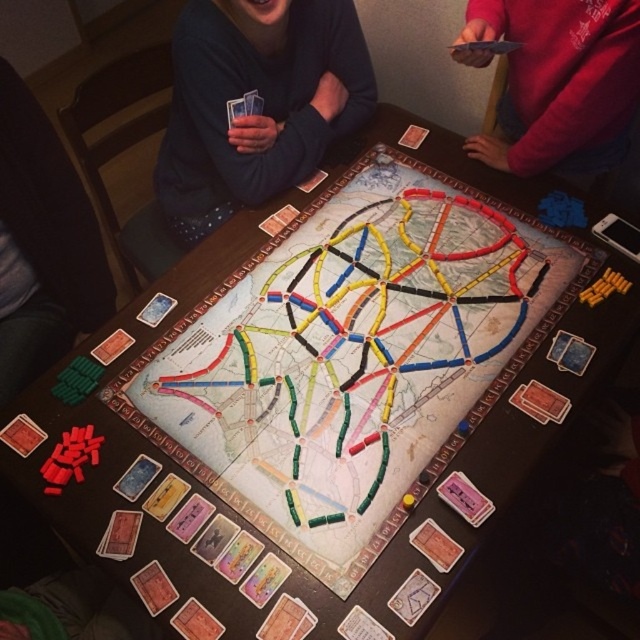
What do you see at coordinates (262, 102) in the screenshot?
I see `dark blue sweater at upper center` at bounding box center [262, 102].

Between point (250, 170) and point (552, 19), which one is positioned behind?

The point (250, 170) is behind.

You are a GUI agent. You are given a task and a screenshot of the screen. Output one action in this format:
    pyautogui.click(x=<x>, y=<y>)
    Task: Click on the dark blue sweater at upper center
    The image size is (640, 640).
    Given the screenshot: What is the action you would take?
    pyautogui.click(x=262, y=102)

At what (x,y) coordinates should I click in order to perform the action: click on dark blue sweater at upper center. Please return your answer as a coordinate pair (x, y). Looking at the image, I should click on (262, 102).